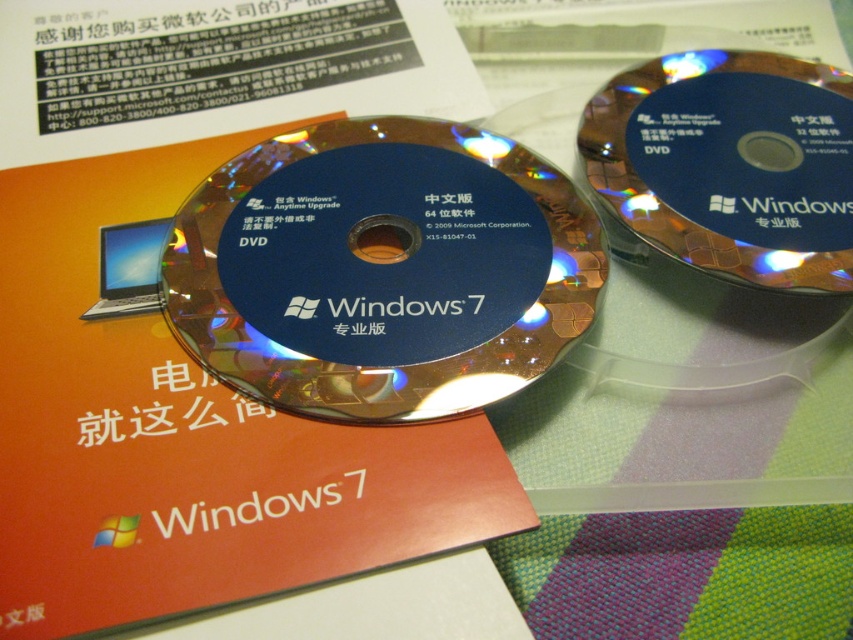
You are a delivery person who needs to place a third DVD between the glossy blue dvd at center and the blue glossy dvd at upper right. The third DVD has a diameter of 4.75 inches. Is there enough space between the two existing DVDs to fit the new one?

The distance between the glossy blue dvd at center and the blue glossy dvd at upper right is 12.66 inches. Since the third DVD has a diameter of 4.75 inches, there is sufficient space as 12.66 inches is greater than 4.75 inches. Therefore, the new DVD can be placed between them.

You are organizing DVDs on a shelf and need to ensure they fit within a 12 cm width limit. You have a glossy blue dvd at center and a blue glossy dvd at upper right. Which one is wider and will exceed the limit if it is 12 cm?

The glossy blue dvd at center is wider than the blue glossy dvd at upper right. If the width limit is 12 cm, the glossy blue dvd at center may exceed the limit, while the blue glossy dvd at upper right is narrower and would fit within the limit.